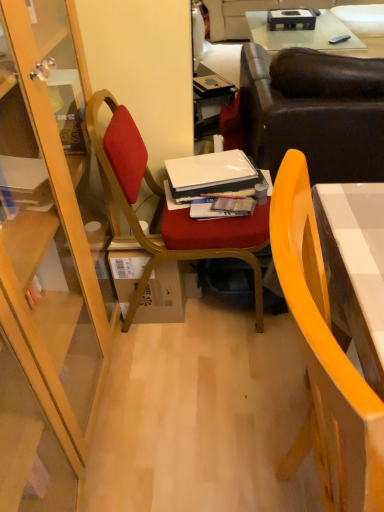
Question: From the image's perspective, does brown cardboard box at center appear lower than leather couch at upper center?

Choices:
 (A) no
 (B) yes

Answer: (B)

Question: Is brown cardboard box at center not close to leather couch at upper center?

Choices:
 (A) yes
 (B) no

Answer: (A)

Question: Considering the relative sizes of brown cardboard box at center and leather couch at upper center in the image provided, is brown cardboard box at center wider than leather couch at upper center?

Choices:
 (A) no
 (B) yes

Answer: (A)

Question: Does brown cardboard box at center have a lesser height compared to leather couch at upper center?

Choices:
 (A) yes
 (B) no

Answer: (A)

Question: Is the position of brown cardboard box at center more distant than that of leather couch at upper center?

Choices:
 (A) no
 (B) yes

Answer: (A)

Question: Is brown cardboard box at center thinner than leather couch at upper center?

Choices:
 (A) yes
 (B) no

Answer: (A)

Question: From the image's perspective, would you say brown cardboard box at center is positioned over matte wood chair at center, which appears as the 2th chair when viewed from the front?

Choices:
 (A) yes
 (B) no

Answer: (B)

Question: Is matte wood chair at center, the 1th chair viewed from the back, located within brown cardboard box at center?

Choices:
 (A) yes
 (B) no

Answer: (B)

Question: Is brown cardboard box at center at the right side of matte wood chair at center, the 1th chair viewed from the back?

Choices:
 (A) no
 (B) yes

Answer: (A)

Question: Does brown cardboard box at center have a larger size compared to matte wood chair at center, which appears as the 2th chair when viewed from the front?

Choices:
 (A) yes
 (B) no

Answer: (B)

Question: Would you say brown cardboard box at center is a long distance from matte wood chair at center, the 1th chair viewed from the back?

Choices:
 (A) yes
 (B) no

Answer: (B)

Question: Is brown cardboard box at center wider than matte wood chair at center, which appears as the 2th chair when viewed from the front?

Choices:
 (A) yes
 (B) no

Answer: (B)

Question: Considering the relative sizes of leather couch at upper right and leather couch at upper center in the image provided, is leather couch at upper right taller than leather couch at upper center?

Choices:
 (A) no
 (B) yes

Answer: (B)